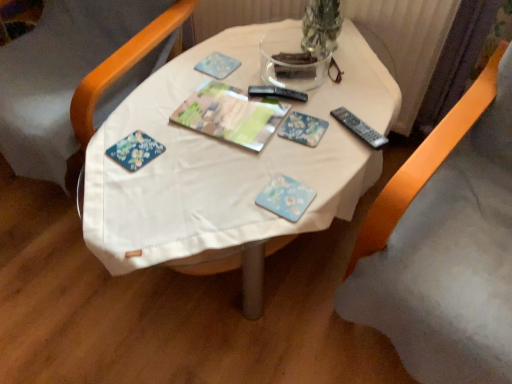
Where is `vacant space behind floral-patterned paper at center, positioned as the first paperback book in back-to-front order`? The image size is (512, 384). vacant space behind floral-patterned paper at center, positioned as the first paperback book in back-to-front order is located at coordinates (304, 91).